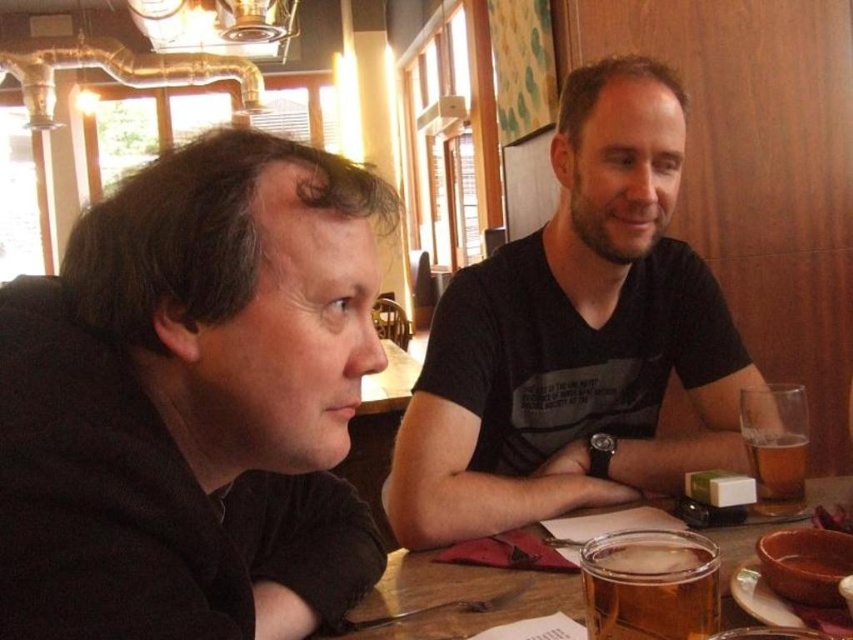
You are a barista trying to place a clear glass mug at center on the table without it touching the black matte shirt at center. Given their relative heights, is this possible?

The black matte shirt at center is much taller than the clear glass mug at center, so placing the mug on the table without touching the shirt might be challenging as the shirt is significantly taller.

You are a barista trying to place a new drink order on the table between the black matte shirt at left and the translucent glass beer at right. The drink is 10 cm in diameter. Can you fit it there without overlapping either object?

The black matte shirt at left is wider than the translucent glass beer at right. Since the shirt is wider, the space between them might be limited. However, the drink is only 10 cm in diameter, so as long as the distance between the shirt and the beer is at least 10 cm, it should fit. But without knowing the exact distance, it is uncertain.

You are a person with a 12 inch long ruler. You want to measure the distance between yourself and the translucent glass beer at lower center. Can you do it with your ruler?

The translucent glass beer at lower center is 20.72 inches from viewer, so the ruler is not long enough to measure the distance between you and the translucent glass beer at lower center.